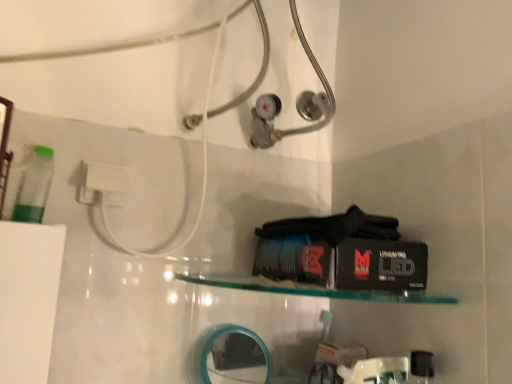
You are a GUI agent. You are given a task and a screenshot of the screen. Output one action in this format:
    pyautogui.click(x=<x>, y=<y>)
    Task: Click on the white plastic plug at upper left
    The width and height of the screenshot is (512, 384).
    Given the screenshot: What is the action you would take?
    pyautogui.click(x=101, y=182)

The image size is (512, 384). What do you see at coordinates (314, 290) in the screenshot?
I see `clear glass shelf at center` at bounding box center [314, 290].

Find the location of `teal plastic mirror at lower center`. teal plastic mirror at lower center is located at coordinates (234, 357).

The width and height of the screenshot is (512, 384). I want to click on white plastic plug at upper left, so click(x=101, y=182).

Based on the photo, is clear glass shelf at center aimed at white plastic plug at upper left?

No, clear glass shelf at center is not turned towards white plastic plug at upper left.

Looking at the image, does clear glass shelf at center seem bigger or smaller compared to white plastic plug at upper left?

clear glass shelf at center is bigger than white plastic plug at upper left.

From a real-world perspective, is clear glass shelf at center positioned over white plastic plug at upper left based on gravity?

Incorrect, from a real-world perspective, clear glass shelf at center is lower than white plastic plug at upper left.

Would you say clear glass shelf at center is outside white plastic plug at upper left?

Yes.

Is white plastic plug at upper left completely or partially outside of teal plastic mirror at lower center?

Indeed, white plastic plug at upper left is completely outside teal plastic mirror at lower center.

Does white plastic plug at upper left appear on the right side of teal plastic mirror at lower center?

In fact, white plastic plug at upper left is to the left of teal plastic mirror at lower center.

In the image, is white plastic plug at upper left positioned in front of or behind teal plastic mirror at lower center?

Clearly, white plastic plug at upper left is in front of teal plastic mirror at lower center.

Considering the relative sizes of white plastic plug at upper left and teal plastic mirror at lower center in the image provided, is white plastic plug at upper left taller than teal plastic mirror at lower center?

No.

Is teal plastic mirror at lower center facing towards clear glass shelf at center?

No, teal plastic mirror at lower center is not oriented towards clear glass shelf at center.

Is teal plastic mirror at lower center placed right next to clear glass shelf at center?

No, teal plastic mirror at lower center is not with clear glass shelf at center.

Between teal plastic mirror at lower center and clear glass shelf at center, which one has less height?

Standing shorter between the two is clear glass shelf at center.

From a real-world perspective, is white plastic plug at upper left beneath clear glass shelf at center?

Actually, white plastic plug at upper left is physically above clear glass shelf at center in the real world.

Looking at this image, is white plastic plug at upper left placed right next to clear glass shelf at center?

No, white plastic plug at upper left is not touching clear glass shelf at center.

Locate an element on the screen. The width and height of the screenshot is (512, 384). shelf below the white plastic plug at upper left (from a real-world perspective) is located at coordinates (314, 290).

Based on the photo, is white plastic plug at upper left behind clear glass shelf at center?

Yes, it is.

Identify the location of mirror directly beneath the clear glass shelf at center (from a real-world perspective). The image size is (512, 384). (234, 357).

In the image, is clear glass shelf at center positioned in front of or behind teal plastic mirror at lower center?

Visually, clear glass shelf at center is located in front of teal plastic mirror at lower center.

Is teal plastic mirror at lower center surrounded by clear glass shelf at center?

Definitely not — teal plastic mirror at lower center is not inside clear glass shelf at center.

Would you say white plastic plug at upper left is part of teal plastic mirror at lower center's contents?

No, white plastic plug at upper left is not inside teal plastic mirror at lower center.

Consider the image. Is teal plastic mirror at lower center touching white plastic plug at upper left?

No, teal plastic mirror at lower center is not making contact with white plastic plug at upper left.

Between teal plastic mirror at lower center and white plastic plug at upper left, which one appears on the right side from the viewer's perspective?

Positioned to the right is teal plastic mirror at lower center.

From the picture: From a real-world perspective, which object rests below the other?

From a 3D spatial view, teal plastic mirror at lower center is below.

Locate an element on the screen. This screenshot has width=512, height=384. shelf below the white plastic plug at upper left (from a real-world perspective) is located at coordinates (314, 290).

This screenshot has height=384, width=512. Find the location of `electric outlet that is on the left side of teal plastic mirror at lower center`. electric outlet that is on the left side of teal plastic mirror at lower center is located at coordinates (101, 182).

When comparing their distances from white plastic plug at upper left, does clear glass shelf at center or teal plastic mirror at lower center seem closer?

clear glass shelf at center lies closer to white plastic plug at upper left than the other object.

Which object lies nearer to the anchor point clear glass shelf at center, teal plastic mirror at lower center or white plastic plug at upper left?

Based on the image, teal plastic mirror at lower center appears to be nearer to clear glass shelf at center.

Estimate the real-world distances between objects in this image. Which object is closer to teal plastic mirror at lower center, white plastic plug at upper left or clear glass shelf at center?

clear glass shelf at center is positioned closer to the anchor teal plastic mirror at lower center.

Considering their positions, is white plastic plug at upper left positioned further to clear glass shelf at center than teal plastic mirror at lower center?

Among the two, white plastic plug at upper left is located further to clear glass shelf at center.

Based on their spatial positions, is teal plastic mirror at lower center or clear glass shelf at center closer to white plastic plug at upper left?

clear glass shelf at center is positioned closer to the anchor white plastic plug at upper left.

Estimate the real-world distances between objects in this image. Which object is further from teal plastic mirror at lower center, clear glass shelf at center or white plastic plug at upper left?

white plastic plug at upper left lies further to teal plastic mirror at lower center than the other object.

Find the location of a particular element. mirror situated between white plastic plug at upper left and clear glass shelf at center from left to right is located at coordinates (234, 357).